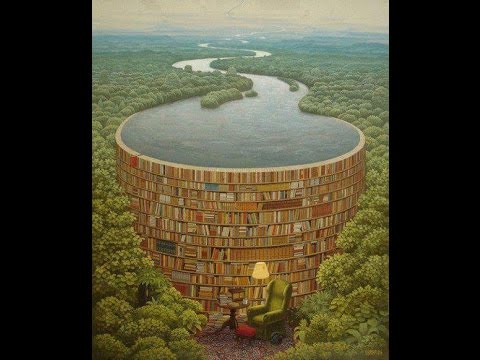
Where is `chair`? The height and width of the screenshot is (360, 480). chair is located at coordinates (273, 314).